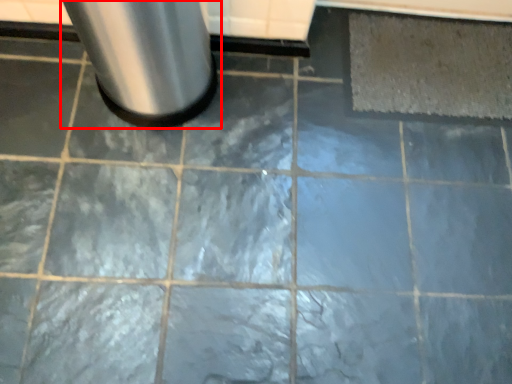
Question: Observing the image, what is the correct spatial positioning of waste container (annotated by the red box) in reference to mat?

Choices:
 (A) left
 (B) right

Answer: (A)